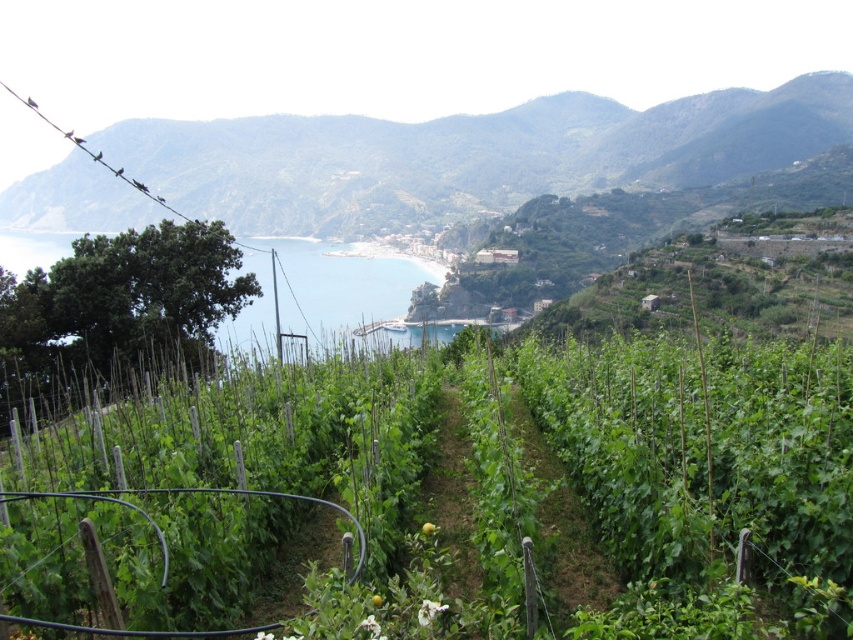
Does green leafy vines at center have a larger size compared to green leafy hillside at upper center?

Actually, green leafy vines at center might be smaller than green leafy hillside at upper center.

Is point (132, 436) farther from viewer compared to point (706, 109)?

No, it is not.

Find the location of `green leafy vines at center`. green leafy vines at center is located at coordinates (474, 490).

What are the coordinates of `green leafy vines at center` in the screenshot? It's located at (474, 490).

The width and height of the screenshot is (853, 640). What do you see at coordinates (474, 490) in the screenshot?
I see `green leafy vines at center` at bounding box center [474, 490].

Where is `green leafy vines at center`? The image size is (853, 640). green leafy vines at center is located at coordinates (474, 490).

The height and width of the screenshot is (640, 853). I want to click on green leafy vines at center, so click(x=474, y=490).

Is green leafy hillside at upper center further to camera compared to blue water at center?

That is True.

Does green leafy hillside at upper center have a smaller size compared to blue water at center?

No, green leafy hillside at upper center is not smaller than blue water at center.

What are the coordinates of `green leafy hillside at upper center` in the screenshot? It's located at (471, 156).